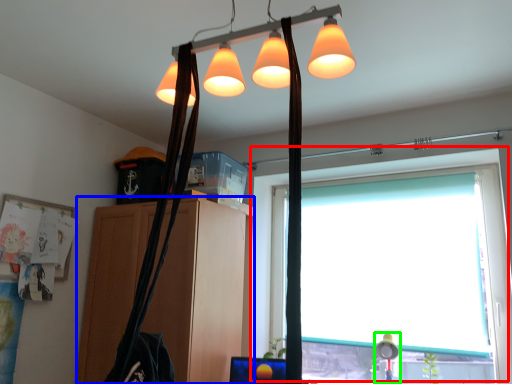
Question: Which object is the farthest from window (highlighted by a red box)? Choose among these: cabinetry (highlighted by a blue box) or table lamp (highlighted by a green box).

Choices:
 (A) cabinetry
 (B) table lamp

Answer: (B)